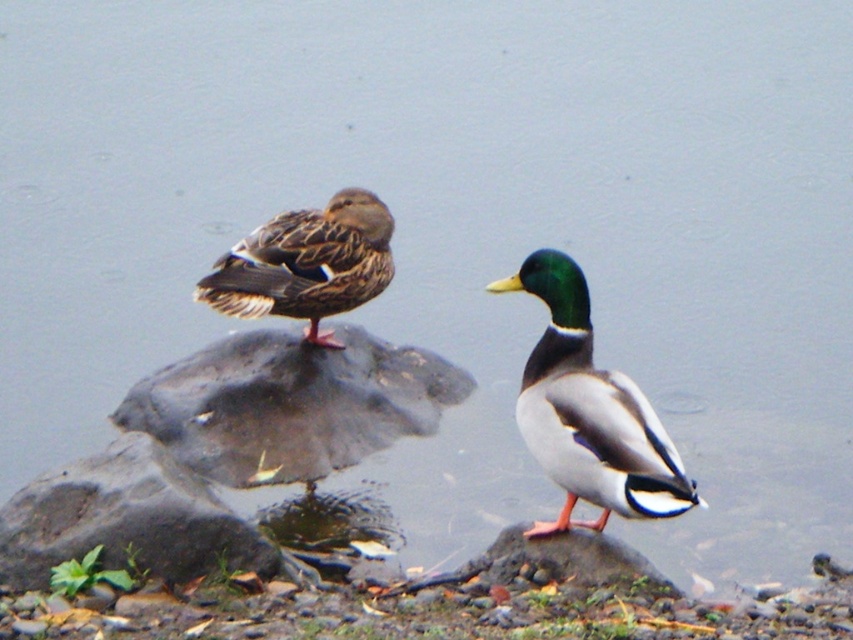
What are the coordinates of the brown speckled feathers at center?

The brown speckled feathers at center are located at coordinates point (306, 262).

In the scene shown: You are a birdwatcher observing the scene. You notice the brown speckled feathers at center and the smooth gray rock at center. Which object is taller in the image?

The brown speckled feathers at center is much taller as smooth gray rock at center.

You are standing 3 meters away from the camera. Is the point at coordinates point (x=62, y=516) closer to you than the camera?

The distance of point (x=62, y=516) from camera is 3.47 meters. Since you are standing 3 meters away from the camera, the point is farther away from you than the camera.